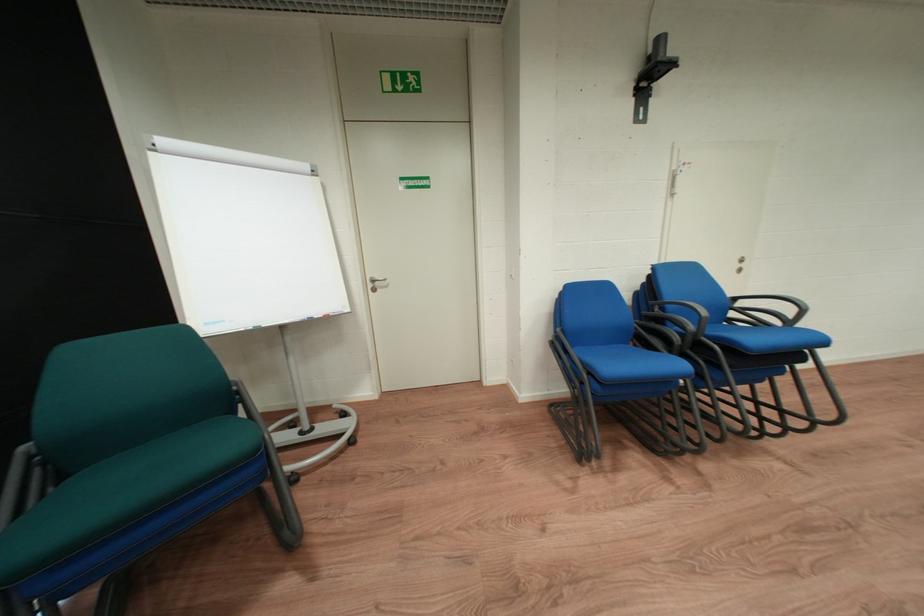
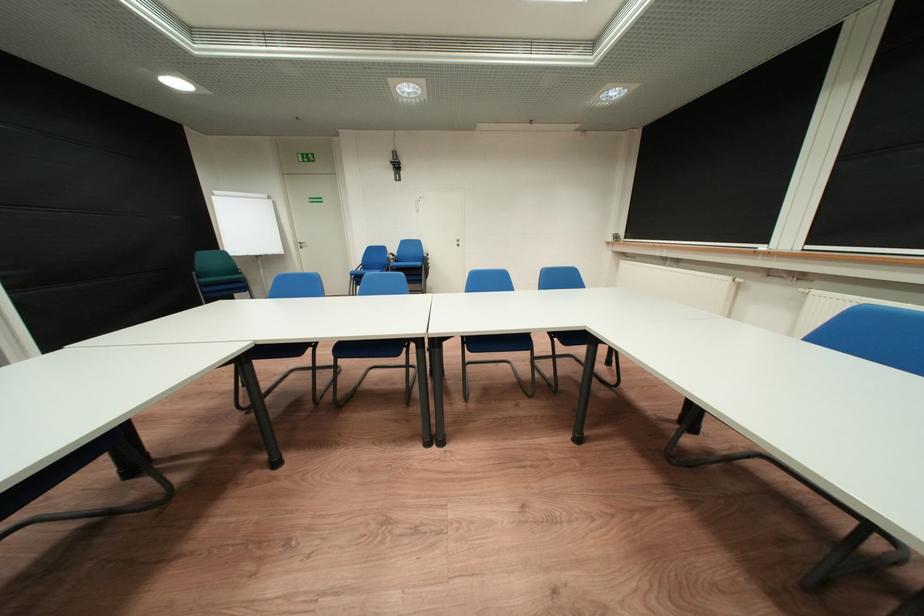
The images are taken continuously from a first-person perspective. In which direction are you moving?

The cameraman walked toward right, backward.